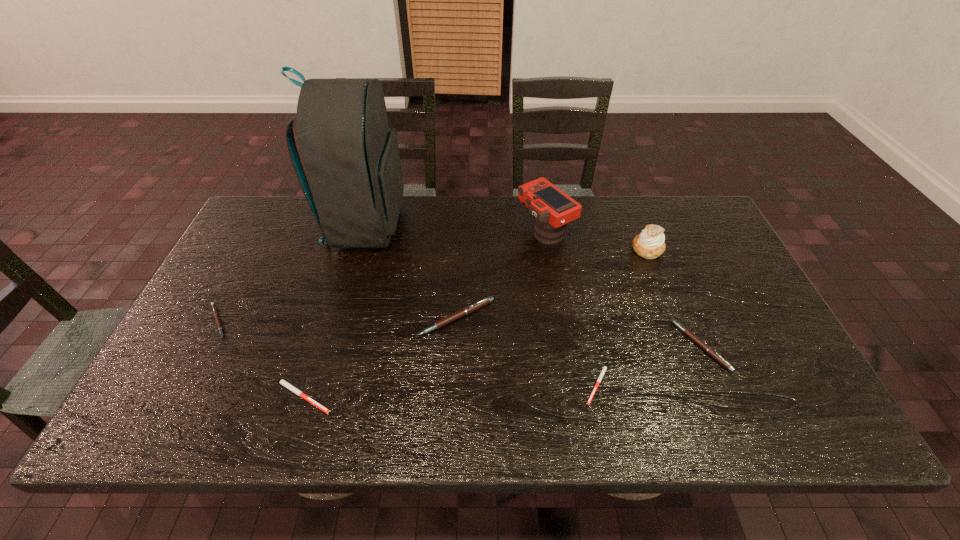
The image size is (960, 540). I want to click on free space that satisfies the following two spatial constraints: 1. at the nib of the fifth shortest object; 2. at the nib of the leftmost object, so click(456, 321).

Locate an element on the screen. The height and width of the screenshot is (540, 960). free space in the image that satisfies the following two spatial constraints: 1. on the front side of the sixth shortest object; 2. on the right side of the seventh shortest object is located at coordinates (547, 249).

Locate an element on the screen. The width and height of the screenshot is (960, 540). free space that satisfies the following two spatial constraints: 1. at the nib of the rightmost pink pen; 2. on the clicker of the smaller white pen is located at coordinates (717, 384).